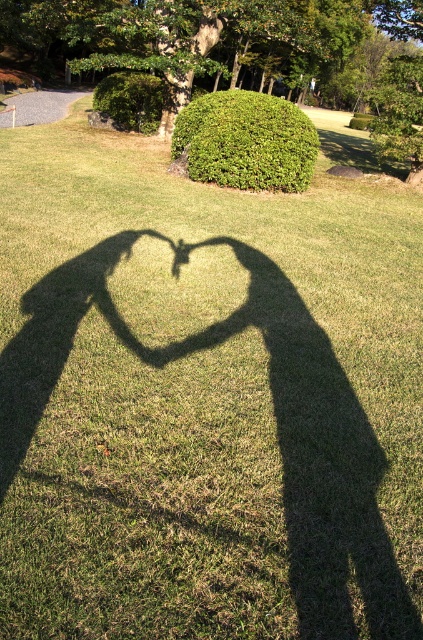
Question: Which point appears closest to the camera in this image?

Choices:
 (A) (115, 108)
 (B) (208, 173)

Answer: (B)

Question: Which point is closer to the camera taking this photo?

Choices:
 (A) (145, 74)
 (B) (285, 120)

Answer: (B)

Question: Can you confirm if green leafy bush at upper center is smaller than green leafy hedge at upper center?

Choices:
 (A) no
 (B) yes

Answer: (B)

Question: Is the position of green leafy bush at upper center less distant than that of green leafy hedge at upper center?

Choices:
 (A) no
 (B) yes

Answer: (B)

Question: Observing the image, what is the correct spatial positioning of green leafy bush at upper center in reference to green leafy hedge at upper center?

Choices:
 (A) left
 (B) right

Answer: (B)